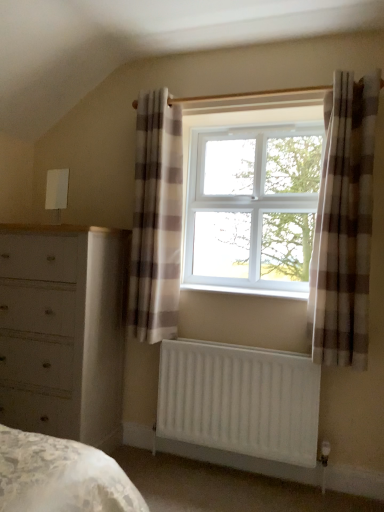
Question: Is white matte radiator at lower center inside the boundaries of white plastic window sill at center, or outside?

Choices:
 (A) outside
 (B) inside

Answer: (A)

Question: Is point (261, 380) positioned closer to the camera than point (291, 289)?

Choices:
 (A) closer
 (B) farther

Answer: (A)

Question: Estimate the real-world distances between objects in this image. Which object is closer to the white plastic window at center?

Choices:
 (A) white plastic window sill at center
 (B) white painted wood chest of drawers at left
 (C) brown checkered curtain at right, placed as the second curtain when sorted from left to right
 (D) white matte radiator at lower center
 (E) plaid fabric curtain at center, which ranks as the 2th curtain in right-to-left order

Answer: (E)

Question: Which of these objects is positioned closest to the white painted wood chest of drawers at left?

Choices:
 (A) white plastic window sill at center
 (B) white matte radiator at lower center
 (C) white plastic window at center
 (D) plaid fabric curtain at center, the first curtain in the left-to-right sequence
 (E) brown checkered curtain at right, the first curtain viewed from the front

Answer: (D)